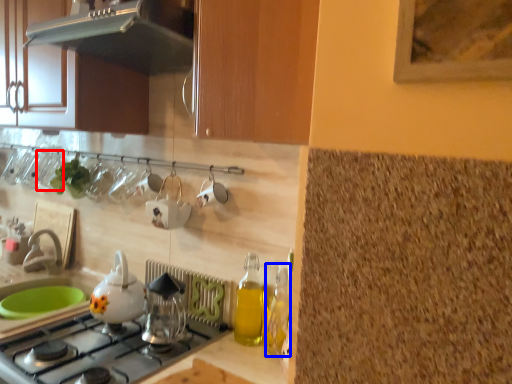
Question: Which object is further to the camera taking this photo, tableware (highlighted by a red box) or bottle (highlighted by a blue box)?

Choices:
 (A) tableware
 (B) bottle

Answer: (A)